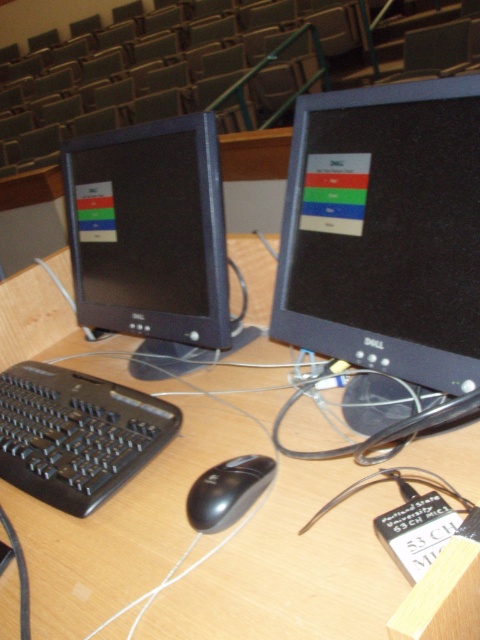
Who is more forward, (44,372) or (239,464)?

Positioned in front is point (239,464).

Does black plastic keyboard at lower left have a greater height compared to black matte mouse at center?

Indeed, black plastic keyboard at lower left has a greater height compared to black matte mouse at center.

Which is in front, point (137, 444) or point (225, 504)?

Point (225, 504) is in front.

The image size is (480, 640). Identify the location of black plastic keyboard at lower left. (76, 435).

Does point (452, 220) come farther from viewer compared to point (229, 518)?

Yes.

Can you confirm if matte black monitor at center is positioned to the right of black matte mouse at center?

Indeed, matte black monitor at center is positioned on the right side of black matte mouse at center.

Between point (444, 192) and point (222, 486), which one is positioned in front?

Point (222, 486)

At what (x,y) coordinates should I click in order to perform the action: click on matte black monitor at center. Please return your answer as a coordinate pair (x, y). Image resolution: width=480 pixels, height=640 pixels. Looking at the image, I should click on (385, 230).

Who is more distant from viewer, (x=297, y=154) or (x=184, y=221)?

The point (x=184, y=221) is more distant.

Where is `matte black monitor at center`? matte black monitor at center is located at coordinates (385, 230).